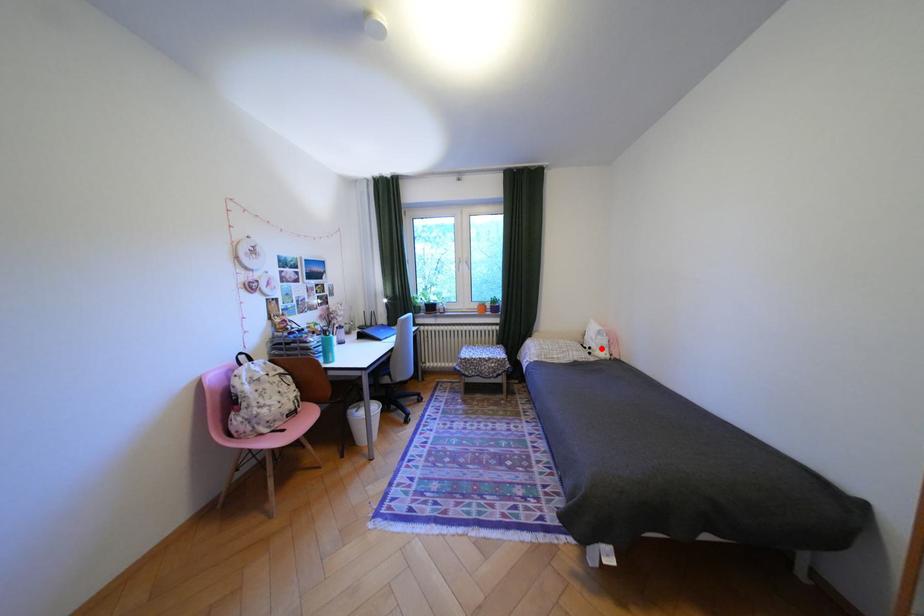
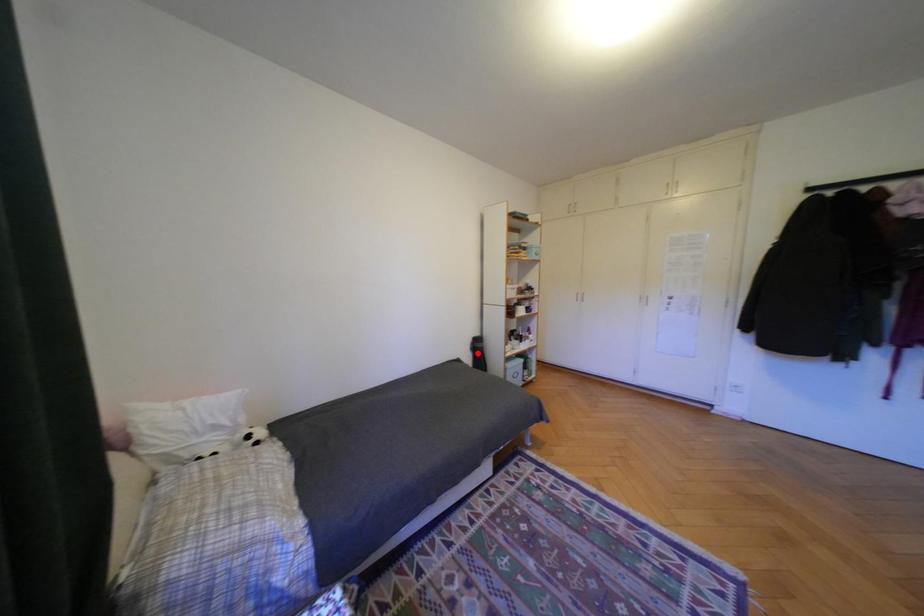
Based on the photo, I am providing you with two images of the same scene from different viewpoints. A red point is marked on the first image and another point is marked on the second image. Is the marked point in image1 the same physical position as the marked point in image2?

No